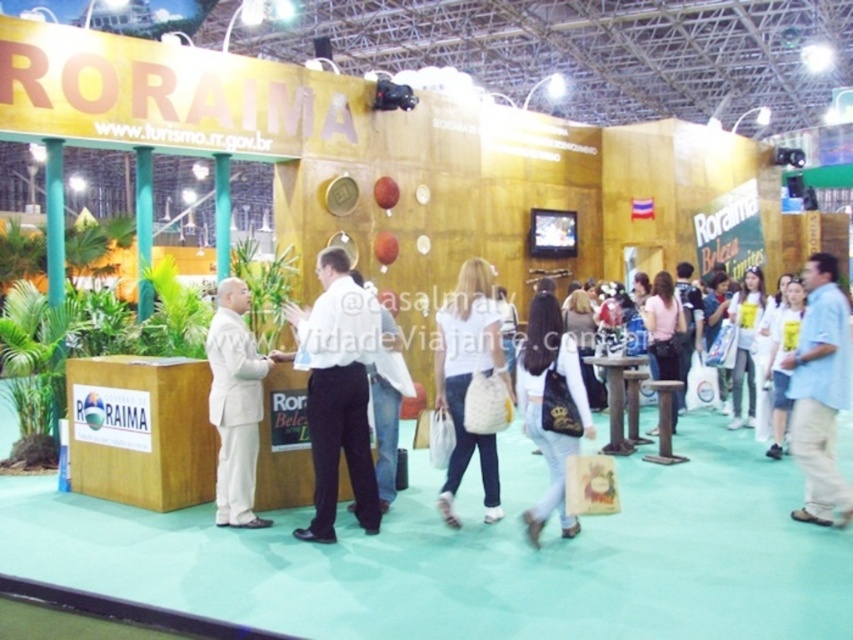
You are a photographer at the trade show and want to take a clear photo of the white smooth shirt at center and the white woven bag at center. Which object should you focus on first to ensure both are in focus?

You should focus on the white smooth shirt at center first because it is in front of the white woven bag at center, so focusing on the closer object will ensure both are in focus.

You are at the Roraima booth and want to pick up both the white woven bag at center and the white fabric bag at lower right. Which one should you move towards first if you are standing to the left of both bags?

You should move towards the white woven bag at center first because it is located to the left of the white fabric bag at lower right, so it is closer to your current position on the left side.